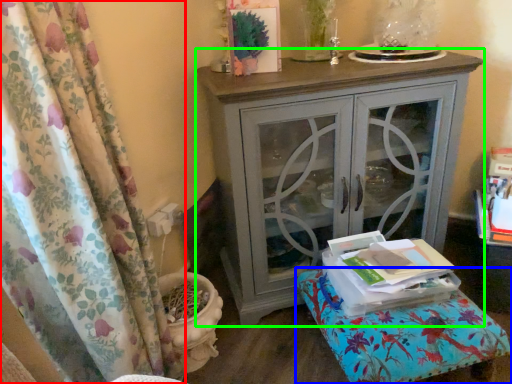
Question: Considering the real-world distances, which object is closest to curtain (highlighted by a red box)? furniture (highlighted by a blue box) or nightstand (highlighted by a green box).

Choices:
 (A) furniture
 (B) nightstand

Answer: (B)